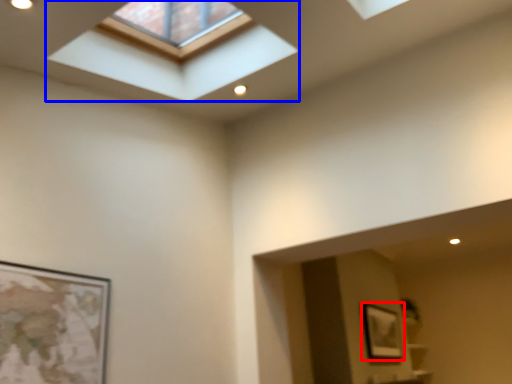
Question: Which of the following is the closest to the observer, picture frame (highlighted by a red box) or window (highlighted by a blue box)?

Choices:
 (A) picture frame
 (B) window

Answer: (B)